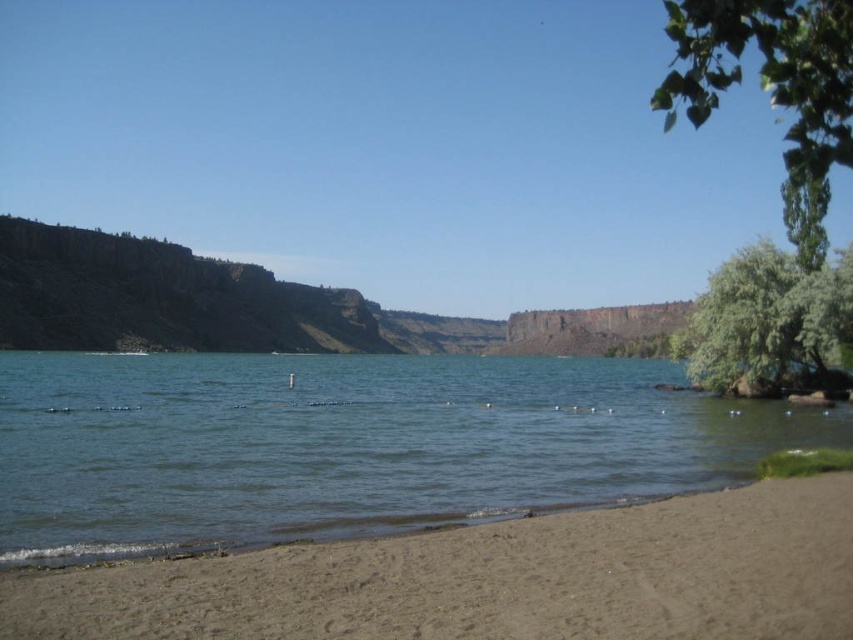
Does clear water at lower center appear on the right side of green leafy tree at upper right?

Incorrect, clear water at lower center is not on the right side of green leafy tree at upper right.

Can you confirm if clear water at lower center is bigger than green leafy tree at upper right?

No.

Between point (389, 369) and point (787, 76), which one is positioned behind?

The point (389, 369) is behind.

In order to click on clear water at lower center in this screenshot , I will do `click(350, 444)`.

Is clear water at lower center below brown sandy beach at lower left?

No.

Is clear water at lower center to the left of brown sandy beach at lower left from the viewer's perspective?

Indeed, clear water at lower center is positioned on the left side of brown sandy beach at lower left.

Between point (733, 440) and point (756, 547), which one is positioned in front?

Point (756, 547)

Where is `clear water at lower center`? The height and width of the screenshot is (640, 853). clear water at lower center is located at coordinates (350, 444).

Is point (714, 548) more distant than point (653, 97)?

No, (714, 548) is in front of (653, 97).

Is brown sandy beach at lower left positioned in front of green leafy tree at upper right?

No, brown sandy beach at lower left is further to the viewer.

You are a GUI agent. You are given a task and a screenshot of the screen. Output one action in this format:
    pyautogui.click(x=<x>, y=<y>)
    Task: Click on the brown sandy beach at lower left
    The image size is (853, 640).
    Given the screenshot: What is the action you would take?
    pyautogui.click(x=492, y=579)

Identify the location of brown sandy beach at lower left. (492, 579).